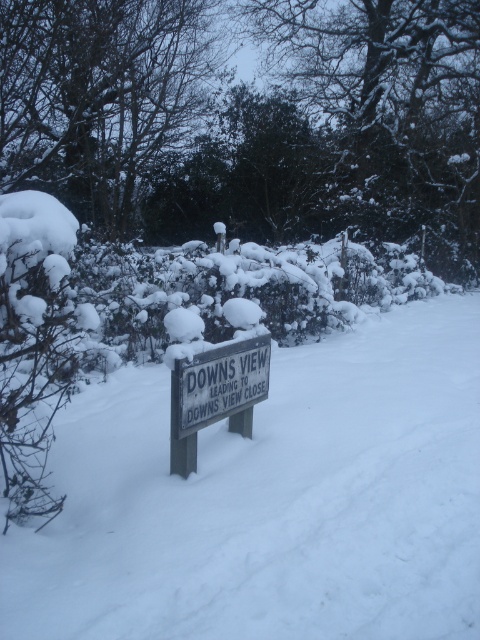
Does snow-covered tree at upper center lie in front of white wooden sign at center?

No, snow-covered tree at upper center is further to the viewer.

Can you confirm if snow-covered tree at upper center is positioned above white wooden sign at center?

Correct, snow-covered tree at upper center is located above white wooden sign at center.

In order to click on snow-covered tree at upper center in this screenshot , I will do `click(100, 97)`.

Looking at this image, is snow-covered tree at center positioned in front of white wooden sign at center?

Result: No, snow-covered tree at center is further to the viewer.

Is snow-covered tree at center bigger than white wooden sign at center?

No, snow-covered tree at center is not bigger than white wooden sign at center.

Is point (376, 113) positioned after point (265, 364)?

That is True.

This screenshot has height=640, width=480. In order to click on snow-covered tree at center in this screenshot , I will do `click(388, 113)`.

Does snow-covered tree at center appear under snow-covered tree at upper center?

No, snow-covered tree at center is not below snow-covered tree at upper center.

Can you confirm if snow-covered tree at center is bigger than snow-covered tree at upper center?

Actually, snow-covered tree at center might be smaller than snow-covered tree at upper center.

Who is more forward, (358, 141) or (115, 232)?

Positioned in front is point (115, 232).

Where is `snow-covered tree at center`? snow-covered tree at center is located at coordinates (388, 113).